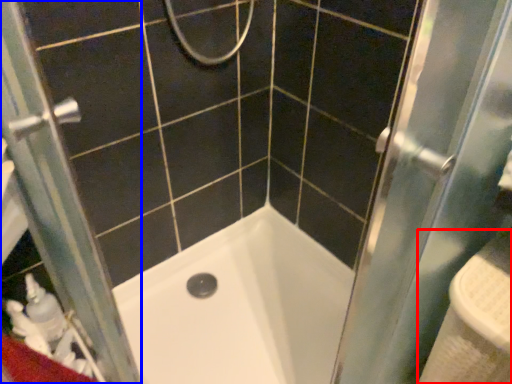
Question: Which point is further to the camera, sink (highlighted by a red box) or screen door (highlighted by a blue box)?

Choices:
 (A) sink
 (B) screen door

Answer: (A)